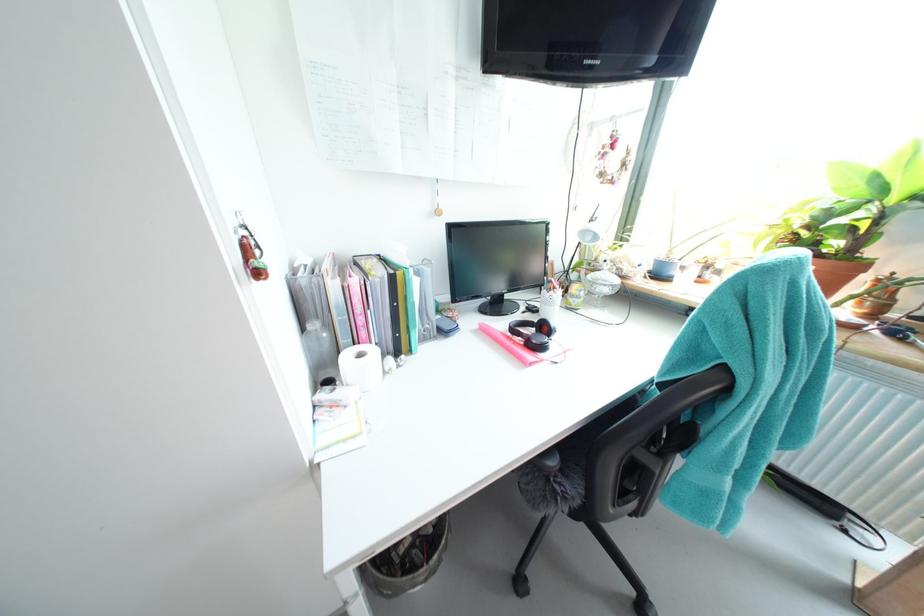
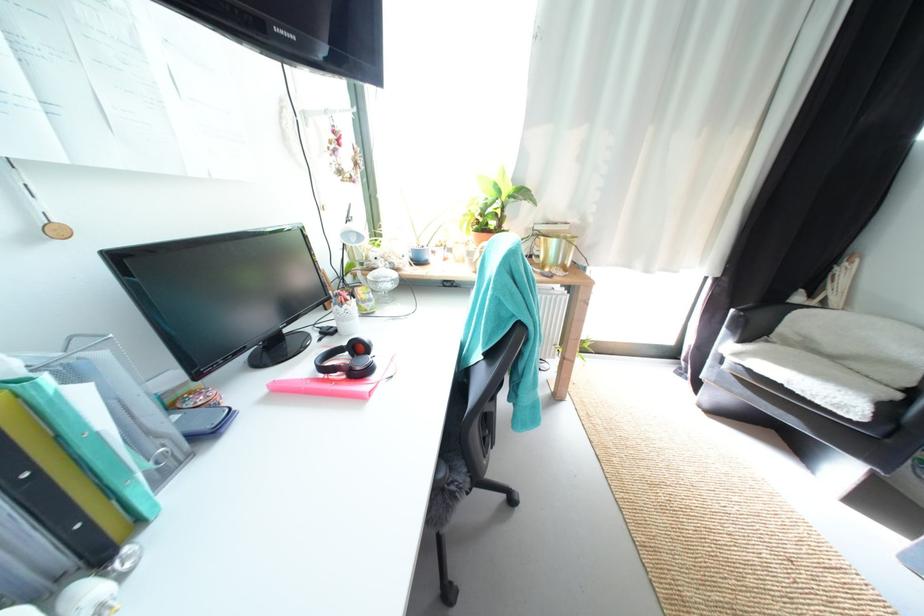
Find the pixel in the second image that matches the point at 488,326 in the first image.

(275, 387)